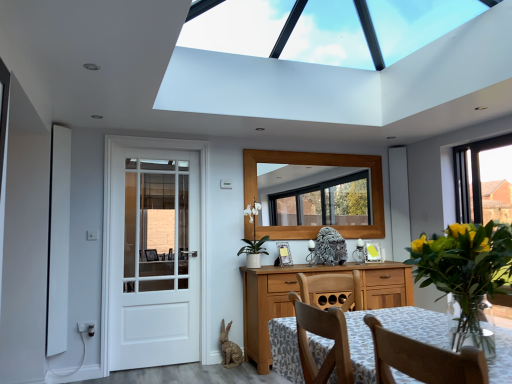
Find the location of a particular element. vacant space situated above white painted wood door at left (from a real-world perspective) is located at coordinates (160, 134).